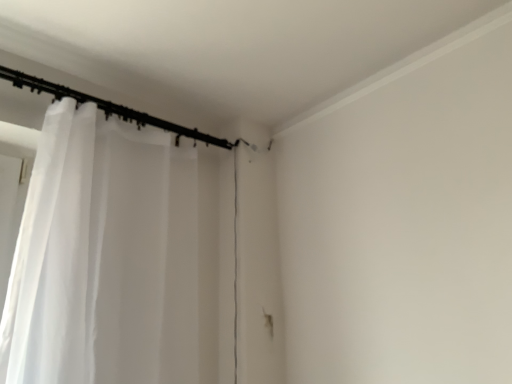
Measure the distance between point (50, 341) and camera.

Point (50, 341) is 4.23 feet away from camera.

Find the location of a particular element. This screenshot has width=512, height=384. sheer white curtain at left is located at coordinates (105, 257).

The height and width of the screenshot is (384, 512). What do you see at coordinates (105, 257) in the screenshot?
I see `sheer white curtain at left` at bounding box center [105, 257].

What are the coordinates of `sheer white curtain at left` in the screenshot? It's located at (105, 257).